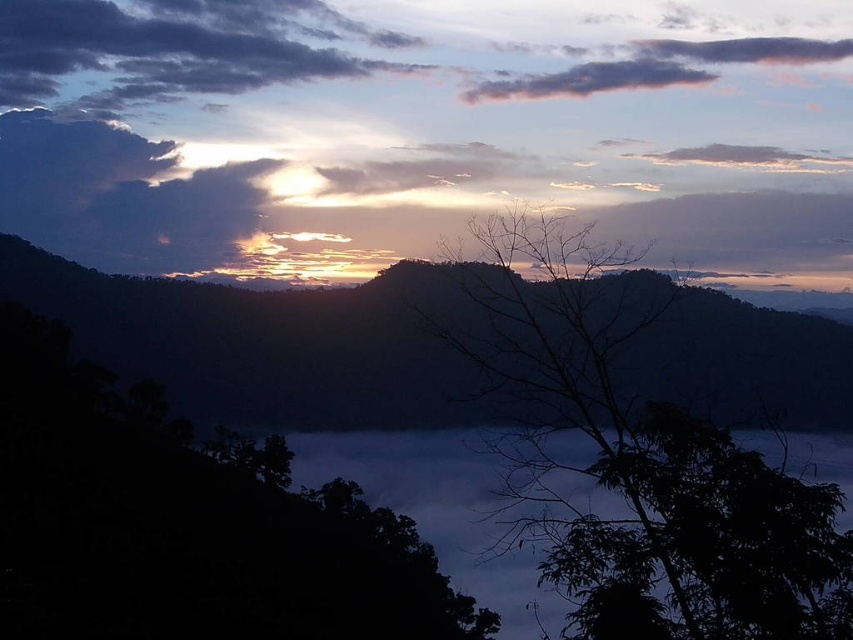
Can you confirm if silhouette leafless branch at center is positioned above silhouetted mountain at center?

Incorrect, silhouette leafless branch at center is not positioned above silhouetted mountain at center.

Is point (590, 321) positioned after point (364, 333)?

That is False.

Where is `silhouette leafless branch at center`? Image resolution: width=853 pixels, height=640 pixels. silhouette leafless branch at center is located at coordinates pyautogui.click(x=636, y=458).

Is point (598, 570) closer to viewer compared to point (82, 8)?

Yes.

At what (x,y) coordinates should I click in order to perform the action: click on silhouette leafless branch at center. Please return your answer as a coordinate pair (x, y). The width and height of the screenshot is (853, 640). Looking at the image, I should click on (636, 458).

Who is more distant from viewer, (656, 188) or (270, 68)?

Point (270, 68)

Based on the photo, which of these two, white mist at lower center or dark gray fluffy cloud at upper left, stands shorter?

dark gray fluffy cloud at upper left

Which is behind, point (70, 115) or point (9, 48)?

Point (9, 48)

This screenshot has width=853, height=640. I want to click on white mist at lower center, so click(x=399, y=120).